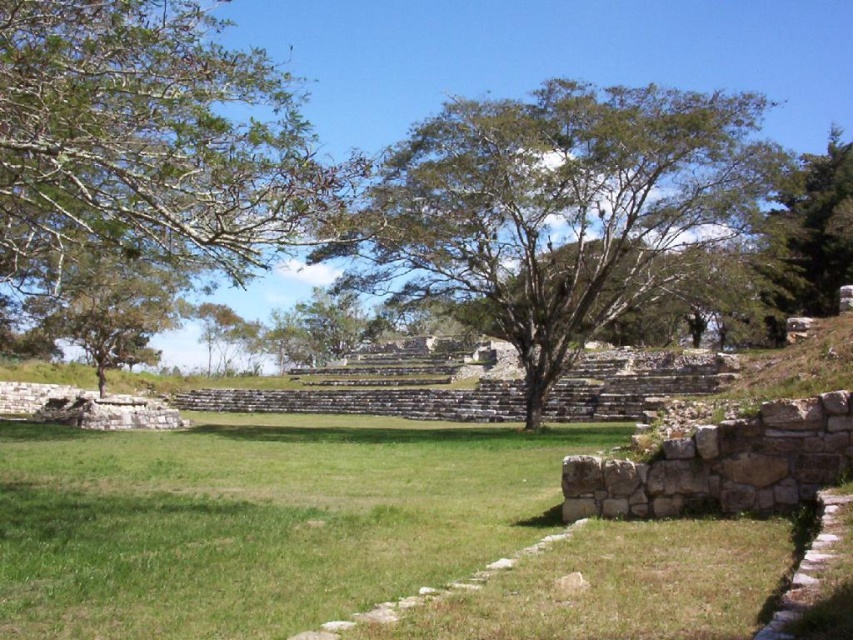
Question: Is green grass at center positioned in front of green leafy tree at upper right?

Choices:
 (A) yes
 (B) no

Answer: (A)

Question: Which point is closer to the camera taking this photo?

Choices:
 (A) (811, 264)
 (B) (120, 353)
 (C) (467, 173)
 (D) (10, 49)

Answer: (D)

Question: Estimate the real-world distances between objects in this image. Which object is farther from the green leafy tree at upper right?

Choices:
 (A) green leafy tree at upper left
 (B) green grass at center
 (C) green leafy tree at left
 (D) green leafy tree at center

Answer: (C)

Question: Which object is positioned farthest from the green leafy tree at center?

Choices:
 (A) green leafy tree at upper right
 (B) green leafy tree at upper left

Answer: (A)

Question: Is green leafy tree at upper right bigger than green leafy tree at left?

Choices:
 (A) no
 (B) yes

Answer: (B)

Question: Does green grass at center appear on the left side of green leafy tree at center?

Choices:
 (A) no
 (B) yes

Answer: (B)